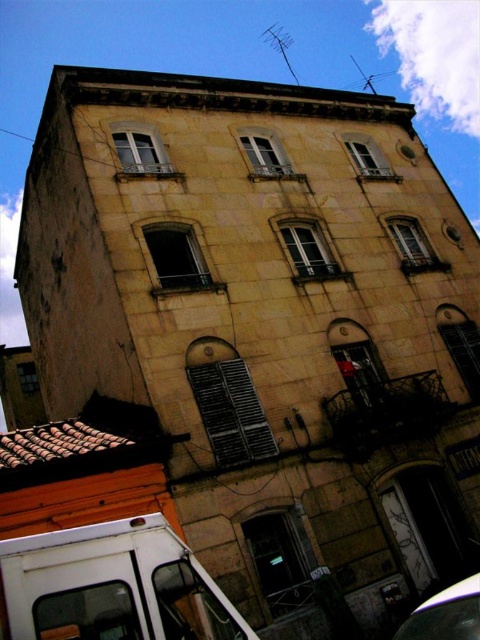
Question: Does white matte van at lower left appear over shiny silver car at lower right?

Choices:
 (A) yes
 (B) no

Answer: (A)

Question: Does white matte van at lower left have a lesser width compared to shiny silver car at lower right?

Choices:
 (A) yes
 (B) no

Answer: (A)

Question: Which point is farther to the camera?

Choices:
 (A) (463, 625)
 (B) (144, 621)

Answer: (A)

Question: Does white matte van at lower left lie behind shiny silver car at lower right?

Choices:
 (A) no
 (B) yes

Answer: (A)